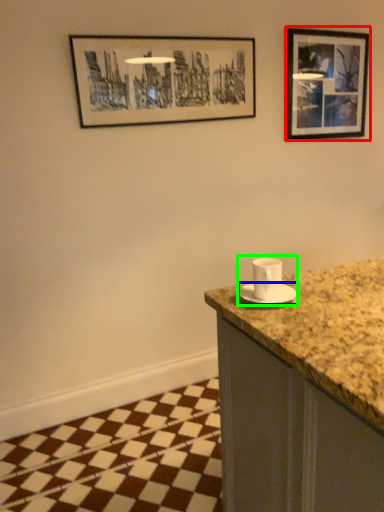
Question: Which is nearer to the picture frame (highlighted by a red box)? saucer (highlighted by a blue box) or sink (highlighted by a green box).

Choices:
 (A) saucer
 (B) sink

Answer: (B)